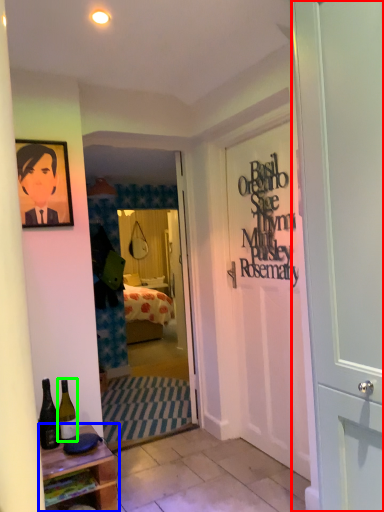
Question: Considering the real-world distances, which object is farthest from door (highlighted by a red box)? table (highlighted by a blue box) or bottle (highlighted by a green box)?

Choices:
 (A) table
 (B) bottle

Answer: (B)